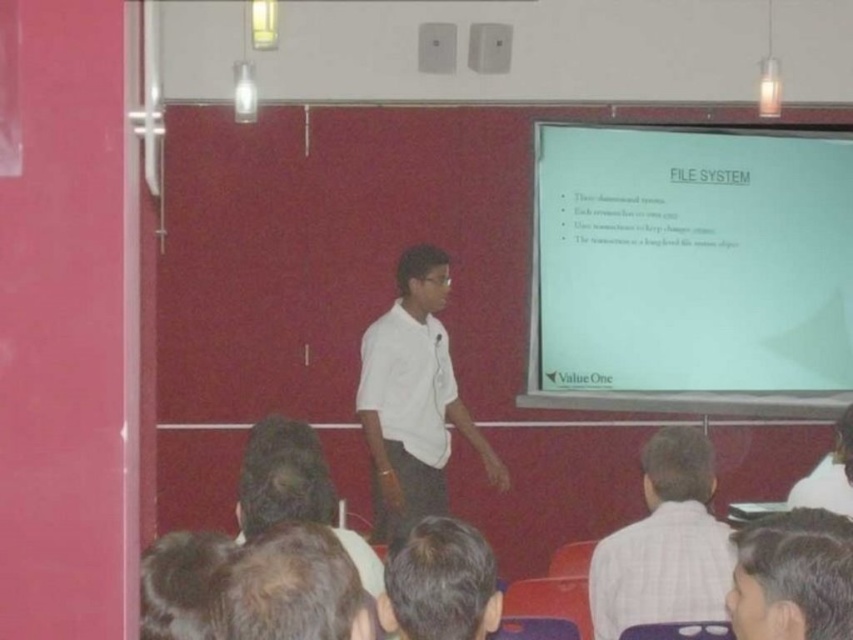
Question: Which point appears farthest from the camera in this image?

Choices:
 (A) (764, 534)
 (B) (712, 570)

Answer: (B)

Question: Among these objects, which one is nearest to the camera?

Choices:
 (A) dark brown hair at lower right
 (B) white checkered shirt at lower right
 (C) white matte shirt at center

Answer: (A)

Question: Where is white matte shirt at center located in relation to brown hair at lower center in the image?

Choices:
 (A) below
 (B) above

Answer: (B)

Question: Which object is closer to the camera taking this photo?

Choices:
 (A) brown hair at lower center
 (B) white matte projection screen at upper right

Answer: (A)

Question: From the image, what is the correct spatial relationship of white matte projection screen at upper right in relation to brown hair at lower center?

Choices:
 (A) left
 (B) right

Answer: (B)

Question: Is the position of white matte projection screen at upper right more distant than that of white checkered shirt at lower right?

Choices:
 (A) yes
 (B) no

Answer: (A)